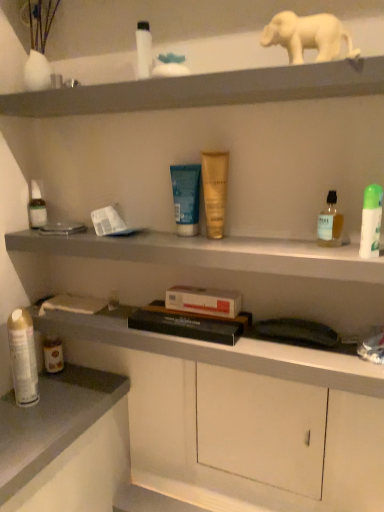
Image resolution: width=384 pixels, height=512 pixels. Find the location of `free point to the right of translucent plastic bottle at left, arranged as the first toiletry when viewed from the back`. free point to the right of translucent plastic bottle at left, arranged as the first toiletry when viewed from the back is located at coordinates (92, 231).